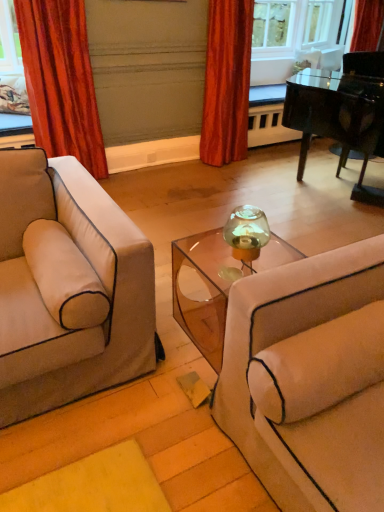
Locate an element on the screen. Image resolution: width=384 pixels, height=512 pixels. vacant area that lies in front of velvet red curtain at upper center, the first curtain when ordered from right to left is located at coordinates (227, 175).